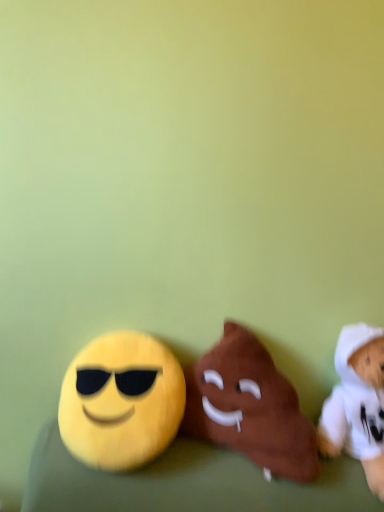
Question: Considering the positions of yellow plush at left, the first toy from the left, and white plush toy at right, arranged as the 3th toy when viewed from the left, in the image, is yellow plush at left, the first toy from the left, taller or shorter than white plush toy at right, arranged as the 3th toy when viewed from the left,?

Choices:
 (A) short
 (B) tall

Answer: (A)

Question: Considering the positions of point (69, 399) and point (344, 441), is point (69, 399) closer or farther from the camera than point (344, 441)?

Choices:
 (A) closer
 (B) farther

Answer: (B)

Question: Based on their relative distances, which object is farther from the white plush toy at right, arranged as the 3th toy when viewed from the left?

Choices:
 (A) brown plush poop at center, which is the 2th toy in left-to-right order
 (B) yellow plush at left, the first toy from the left

Answer: (B)

Question: Based on their relative distances, which object is farther from the white plush toy at right, arranged as the 3th toy when viewed from the left?

Choices:
 (A) brown plush poop at center, arranged as the second toy when viewed from the right
 (B) yellow plush at left, the third toy positioned from the right

Answer: (B)